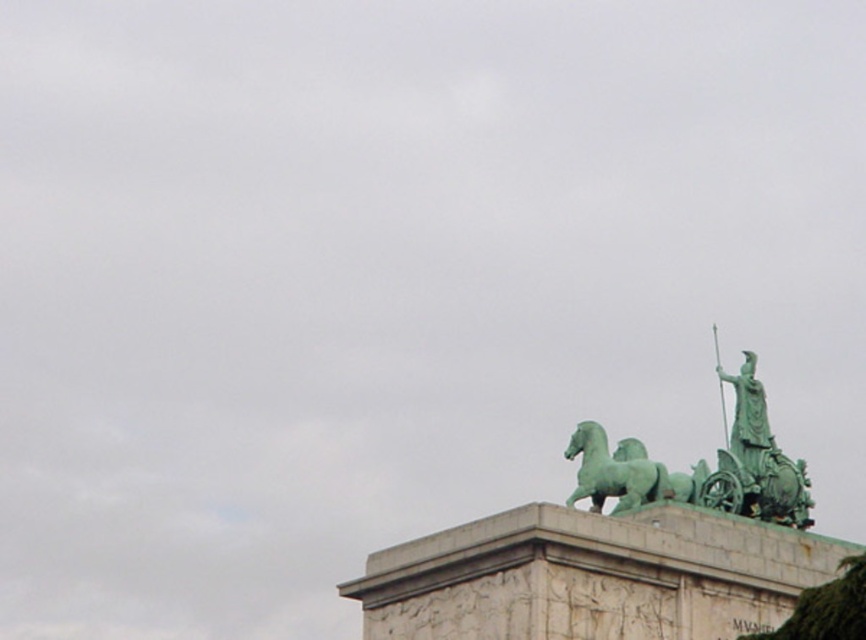
Question: Which point appears closest to the camera in this image?

Choices:
 (A) (776, 513)
 (B) (828, 596)
 (C) (592, 448)
 (D) (731, 461)

Answer: (B)

Question: Which of the following is the closest to the observer?

Choices:
 (A) green mossy tree at lower right
 (B) green polished metal chariot at upper right
 (C) green polished stone horse at upper center
 (D) green patinated bronze chariot at upper right

Answer: (A)

Question: Is green polished metal chariot at upper right bigger than green patinated bronze chariot at upper right?

Choices:
 (A) no
 (B) yes

Answer: (B)

Question: Does green patinated bronze chariot at upper right appear on the right side of green mossy tree at lower right?

Choices:
 (A) yes
 (B) no

Answer: (A)

Question: Among these objects, which one is nearest to the camera?

Choices:
 (A) green polished metal chariot at upper right
 (B) green mossy tree at lower right
 (C) green patinated bronze chariot at upper right
 (D) green polished stone horse at upper center

Answer: (B)

Question: Can you confirm if green polished metal chariot at upper right is positioned above green polished stone horse at upper center?

Choices:
 (A) no
 (B) yes

Answer: (B)